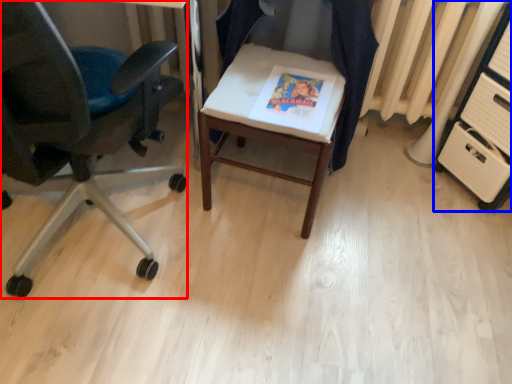
Question: Which point is closer to the camera, chair (highlighted by a red box) or file cabinet (highlighted by a blue box)?

Choices:
 (A) chair
 (B) file cabinet

Answer: (A)